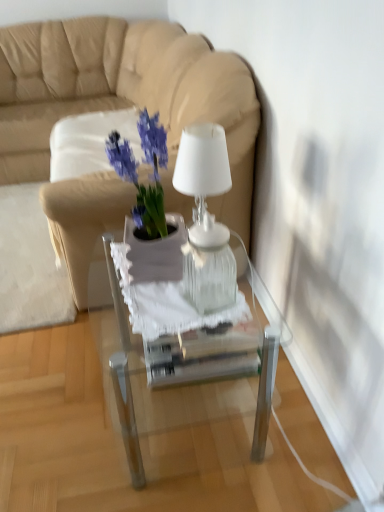
Measure the distance between transparent glass box at center and camera.

transparent glass box at center and camera are 3.47 feet apart from each other.

Where is `beige leather couch at upper left`? The image size is (384, 512). beige leather couch at upper left is located at coordinates (125, 95).

Measure the distance between point (174, 174) and camera.

Point (174, 174) and camera are 3.95 feet apart.

Find the location of a particular element. This screenshot has height=512, width=384. matte purple plant at center is located at coordinates (149, 204).

Considering the sizes of objects beige leather couch at upper left and matte purple plant at center in the image provided, who is thinner, beige leather couch at upper left or matte purple plant at center?

Thinner between the two is matte purple plant at center.

Considering the relative sizes of beige leather couch at upper left and matte purple plant at center in the image provided, is beige leather couch at upper left bigger than matte purple plant at center?

Yes.

Which of these two, beige leather couch at upper left or matte purple plant at center, stands shorter?

matte purple plant at center.

Is beige leather couch at upper left in contact with matte purple plant at center?

beige leather couch at upper left and matte purple plant at center are not in contact.

Does transparent glass lamp at center contain clear glass table at center?

Definitely not — clear glass table at center is not inside transparent glass lamp at center.

Is transparent glass lamp at center at the right side of clear glass table at center?

Yes, transparent glass lamp at center is to the right of clear glass table at center.

From a real-world perspective, is transparent glass lamp at center located beneath clear glass table at center?

Actually, transparent glass lamp at center is physically above clear glass table at center in the real world.

Is transparent glass lamp at center oriented away from matte purple plant at center?

No, transparent glass lamp at center's orientation is not away from matte purple plant at center.

From the image's perspective, which is below, transparent glass lamp at center or matte purple plant at center?

From the image's view, transparent glass lamp at center is below.

Considering the sizes of objects transparent glass lamp at center and matte purple plant at center in the image provided, who is wider, transparent glass lamp at center or matte purple plant at center?

matte purple plant at center is wider.

Is point (186, 128) behind point (149, 218)?

Yes, point (186, 128) is behind point (149, 218).

Is clear glass table at center turned away from transparent glass lamp at center?

No, clear glass table at center's orientation is not away from transparent glass lamp at center.

Measure the distance between clear glass table at center and transparent glass lamp at center.

The distance of clear glass table at center from transparent glass lamp at center is 8.43 inches.

Is clear glass table at center to the left or to the right of transparent glass lamp at center in the image?

clear glass table at center is positioned on transparent glass lamp at center's left side.

Does clear glass table at center have a smaller size compared to transparent glass lamp at center?

Actually, clear glass table at center might be larger than transparent glass lamp at center.

From the image's perspective, is transparent glass lamp at center above or below beige leather couch at upper left?

Based on their image positions, transparent glass lamp at center is located beneath beige leather couch at upper left.

From a real-world perspective, is transparent glass lamp at center below beige leather couch at upper left?

No, from a real-world perspective, transparent glass lamp at center is not beneath beige leather couch at upper left.

Is transparent glass lamp at center oriented away from beige leather couch at upper left?

No.

From a real-world perspective, is transparent glass box at center over beige leather couch at upper left?

Actually, transparent glass box at center is physically below beige leather couch at upper left in the real world.

How much distance is there between transparent glass box at center and beige leather couch at upper left?

transparent glass box at center is 2.15 meters from beige leather couch at upper left.

From the image's perspective, is transparent glass box at center under beige leather couch at upper left?

Yes, from the image's perspective, transparent glass box at center is beneath beige leather couch at upper left.

From a real-world perspective, is clear glass table at center on top of transparent glass box at center?

Incorrect, from a real-world perspective, clear glass table at center is lower than transparent glass box at center.

Is clear glass table at center at the right side of transparent glass box at center?

No.

Is clear glass table at center far away from transparent glass box at center?

Actually, clear glass table at center and transparent glass box at center are a little close together.

The image size is (384, 512). In order to click on houseplant on the right of beige leather couch at upper left in this screenshot , I will do `click(149, 204)`.

Locate an element on the screen. The width and height of the screenshot is (384, 512). lamp positioned vertically above the clear glass table at center (from a real-world perspective) is located at coordinates [x=206, y=218].

Considering their positions, is beige leather couch at upper left positioned further to matte purple plant at center than clear glass table at center?

beige leather couch at upper left is positioned further to the anchor matte purple plant at center.

Looking at the image, which one is located further to beige leather couch at upper left, transparent glass lamp at center or matte purple plant at center?

Based on the image, matte purple plant at center appears to be further to beige leather couch at upper left.

Estimate the real-world distances between objects in this image. Which object is further from transparent glass box at center, transparent glass lamp at center or beige leather couch at upper left?

beige leather couch at upper left.

When comparing their distances from transparent glass lamp at center, does beige leather couch at upper left or matte purple plant at center seem further?

beige leather couch at upper left.

From the picture: Considering their positions, is beige leather couch at upper left positioned further to clear glass table at center than transparent glass box at center?

beige leather couch at upper left is further to clear glass table at center.

When comparing their distances from transparent glass box at center, does beige leather couch at upper left or matte purple plant at center seem closer?

matte purple plant at center is closer to transparent glass box at center.

From the image, which object appears to be nearer to matte purple plant at center, transparent glass lamp at center or clear glass table at center?

transparent glass lamp at center.

From the picture: Based on their spatial positions, is matte purple plant at center or transparent glass box at center further from clear glass table at center?

matte purple plant at center lies further to clear glass table at center than the other object.

Identify the location of glass box between beige leather couch at upper left and clear glass table at center vertically. The width and height of the screenshot is (384, 512). (202, 355).

Identify the location of lamp between beige leather couch at upper left and transparent glass box at center in the up-down direction. (206, 218).

This screenshot has height=512, width=384. What are the coordinates of `houseplant between beige leather couch at upper left and transparent glass lamp at center in the vertical direction` in the screenshot? It's located at (149, 204).

At what (x,y) coordinates should I click in order to perform the action: click on houseplant between beige leather couch at upper left and clear glass table at center in the vertical direction. Please return your answer as a coordinate pair (x, y). Image resolution: width=384 pixels, height=512 pixels. Looking at the image, I should click on (149, 204).